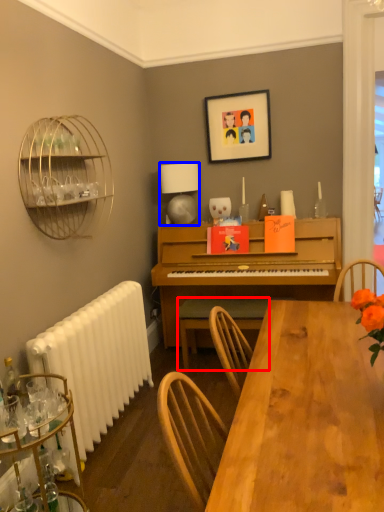
Question: Which object is closer to the camera taking this photo, chair (highlighted by a red box) or lamp (highlighted by a blue box)?

Choices:
 (A) chair
 (B) lamp

Answer: (A)